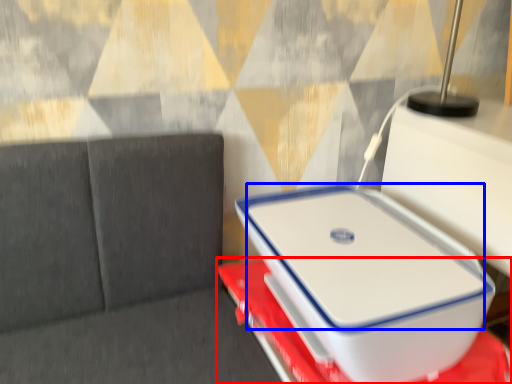
Question: Among these objects, which one is nearest to the camera, furniture (highlighted by a red box) or laptop (highlighted by a blue box)?

Choices:
 (A) furniture
 (B) laptop

Answer: (A)